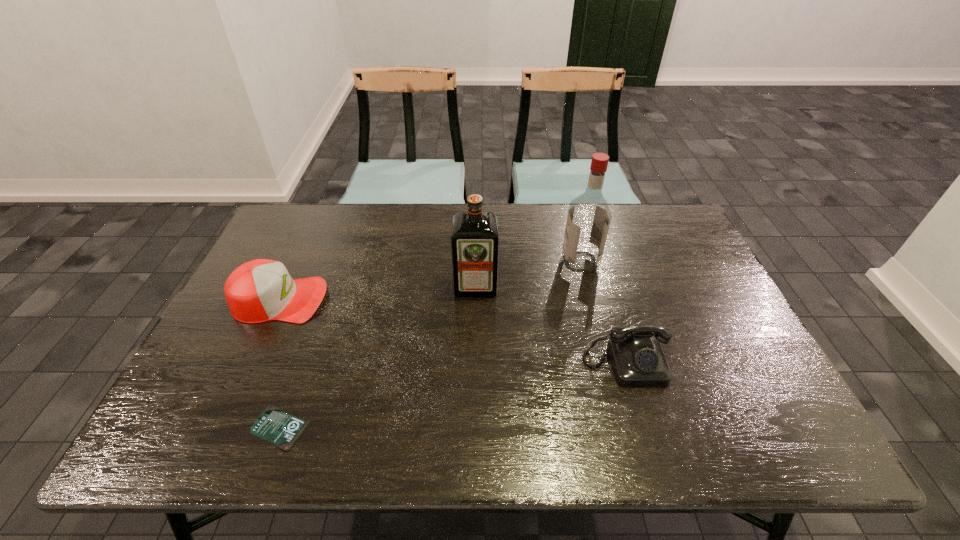
Identify the location of vacant space at the right edge. The image size is (960, 540). (672, 312).

Identify the location of free space at the near left corner of the desktop. The height and width of the screenshot is (540, 960). (179, 427).

You are a GUI agent. You are given a task and a screenshot of the screen. Output one action in this format:
    pyautogui.click(x=<x>, y=<y>)
    Task: Click on the vacant space at the far right corner
    
    Given the screenshot: What is the action you would take?
    pyautogui.click(x=676, y=233)

You are a GUI agent. You are given a task and a screenshot of the screen. Output one action in this format:
    pyautogui.click(x=<x>, y=<y>)
    Task: Click on the empty location between the third object from right to left and the shortest object
    
    Given the screenshot: What is the action you would take?
    pyautogui.click(x=378, y=357)

Where is `free space between the baseball cap and the right liquor`? Image resolution: width=960 pixels, height=540 pixels. free space between the baseball cap and the right liquor is located at coordinates (430, 280).

The width and height of the screenshot is (960, 540). I want to click on vacant space that's between the nearer liquor and the fourth tallest object, so click(x=550, y=325).

You are a GUI agent. You are given a task and a screenshot of the screen. Output one action in this format:
    pyautogui.click(x=<x>, y=<y>)
    Task: Click on the unoccupied position between the nearer liquor and the telephone
    This screenshot has width=960, height=540.
    Given the screenshot: What is the action you would take?
    pyautogui.click(x=550, y=325)

Where is `free spot between the taller liquor and the shorter liquor`? Image resolution: width=960 pixels, height=540 pixels. free spot between the taller liquor and the shorter liquor is located at coordinates (528, 274).

You are a GUI agent. You are given a task and a screenshot of the screen. Output one action in this format:
    pyautogui.click(x=<x>, y=<y>)
    Task: Click on the free area in between the shortest object and the baseball cap
    This screenshot has height=540, width=960.
    Given the screenshot: What is the action you would take?
    pyautogui.click(x=280, y=363)

At what (x,y) coordinates should I click in order to perform the action: click on unoccupied position between the third object from left to right and the identity card. Please return your answer as a coordinate pair (x, y). The height and width of the screenshot is (540, 960). Looking at the image, I should click on (378, 357).